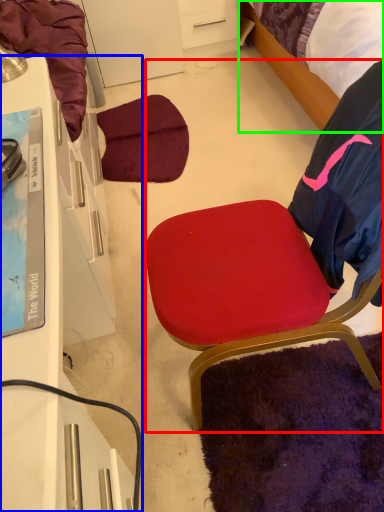
Question: Which object is the closest to the chair (highlighted by a red box)? Choose among these: desk (highlighted by a blue box) or bed (highlighted by a green box).

Choices:
 (A) desk
 (B) bed

Answer: (A)